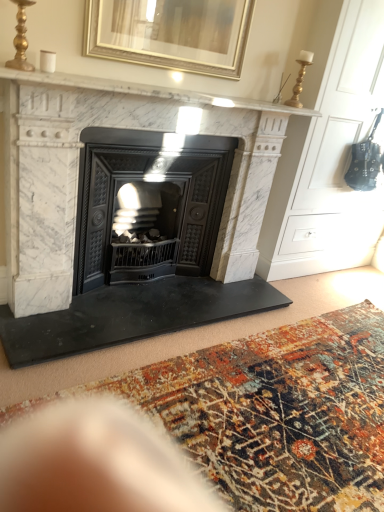
Question: Is white marble fireplace at upper center outside white marble fireplace at center?

Choices:
 (A) no
 (B) yes

Answer: (A)

Question: Is the depth of white marble fireplace at upper center greater than that of white marble fireplace at center?

Choices:
 (A) no
 (B) yes

Answer: (A)

Question: Is white marble fireplace at upper center to the left of white marble fireplace at center from the viewer's perspective?

Choices:
 (A) yes
 (B) no

Answer: (B)

Question: Does white marble fireplace at upper center lie in front of white marble fireplace at center?

Choices:
 (A) yes
 (B) no

Answer: (A)

Question: From the image's perspective, is white marble fireplace at upper center on top of white marble fireplace at center?

Choices:
 (A) no
 (B) yes

Answer: (B)

Question: From a real-world perspective, is white marble fireplace at upper center under white marble fireplace at center?

Choices:
 (A) yes
 (B) no

Answer: (B)

Question: Considering the relative sizes of white marble fireplace at center and gold metallic picture frame at upper center in the image provided, is white marble fireplace at center bigger than gold metallic picture frame at upper center?

Choices:
 (A) no
 (B) yes

Answer: (B)

Question: From a real-world perspective, is white marble fireplace at center beneath gold metallic picture frame at upper center?

Choices:
 (A) no
 (B) yes

Answer: (B)

Question: Is white marble fireplace at center positioned before gold metallic picture frame at upper center?

Choices:
 (A) no
 (B) yes

Answer: (B)

Question: Considering the relative positions of white marble fireplace at center and gold metallic picture frame at upper center in the image provided, is white marble fireplace at center behind gold metallic picture frame at upper center?

Choices:
 (A) yes
 (B) no

Answer: (B)

Question: From the image's perspective, is white marble fireplace at center located above gold metallic picture frame at upper center?

Choices:
 (A) yes
 (B) no

Answer: (B)

Question: Would you say white marble fireplace at center is a long distance from gold metallic picture frame at upper center?

Choices:
 (A) yes
 (B) no

Answer: (B)

Question: From the image's perspective, would you say black cast iron wood burning stove at center is shown under gold metallic picture frame at upper center?

Choices:
 (A) yes
 (B) no

Answer: (A)